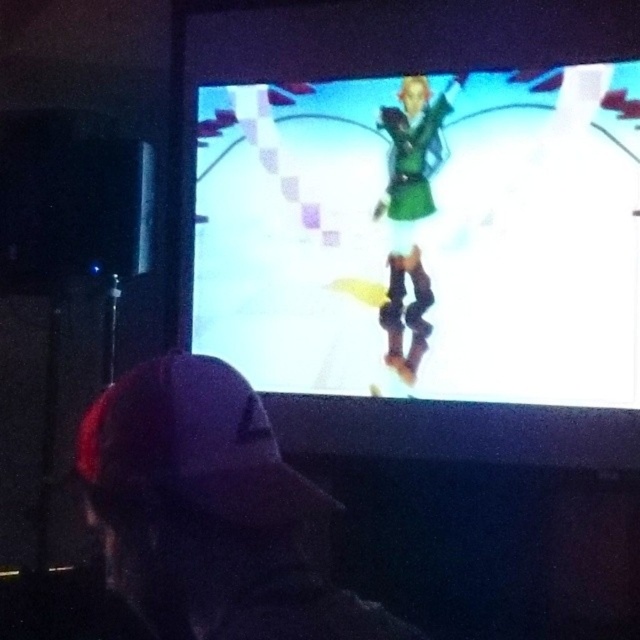
Is dark fabric cap at lower left shorter than green matte dress at center?

Yes, dark fabric cap at lower left is shorter than green matte dress at center.

Describe the element at coordinates (211, 513) in the screenshot. I see `dark fabric cap at lower left` at that location.

In order to click on dark fabric cap at lower left in this screenshot , I will do `click(211, 513)`.